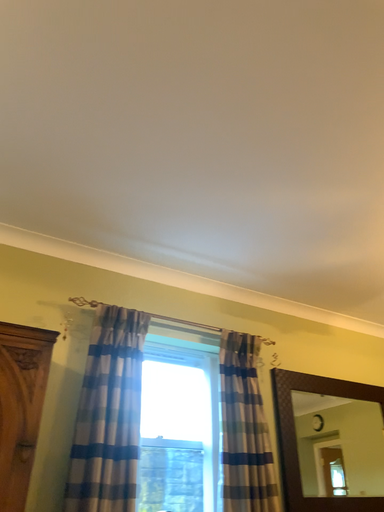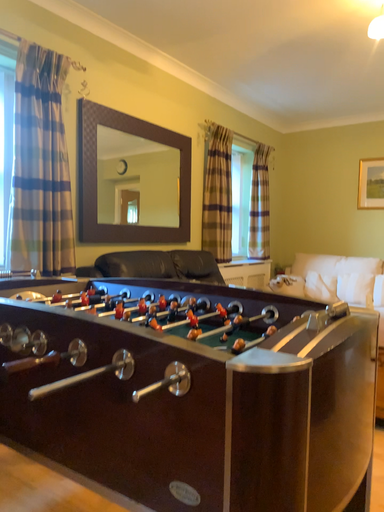
Question: How did the camera likely rotate when shooting the video?

Choices:
 (A) rotated right
 (B) rotated left

Answer: (A)